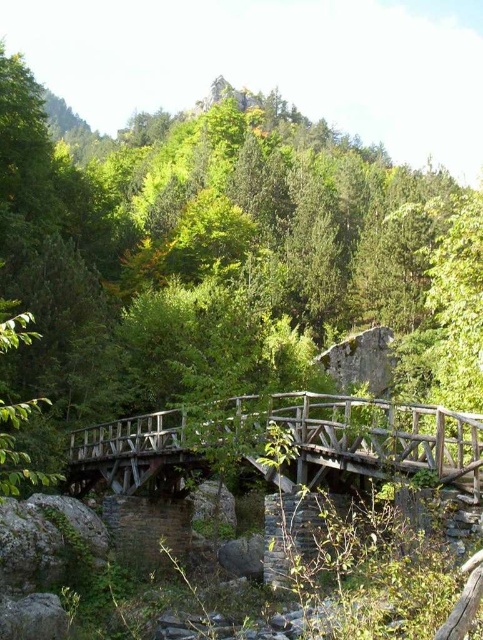
Question: Among these points, which one is farthest from the camera?

Choices:
 (A) (272, 371)
 (B) (470, 486)

Answer: (A)

Question: Is green matte tree at center closer to the viewer compared to wooden bridge at center?

Choices:
 (A) no
 (B) yes

Answer: (A)

Question: Does green matte tree at center have a smaller size compared to wooden bridge at center?

Choices:
 (A) no
 (B) yes

Answer: (A)

Question: Does green matte tree at center have a smaller size compared to wooden bridge at center?

Choices:
 (A) yes
 (B) no

Answer: (B)

Question: Which point is farther from the camera taking this photo?

Choices:
 (A) (408, 404)
 (B) (50, 397)

Answer: (B)

Question: Which point is farther to the camera?

Choices:
 (A) (283, 285)
 (B) (392, 454)

Answer: (A)